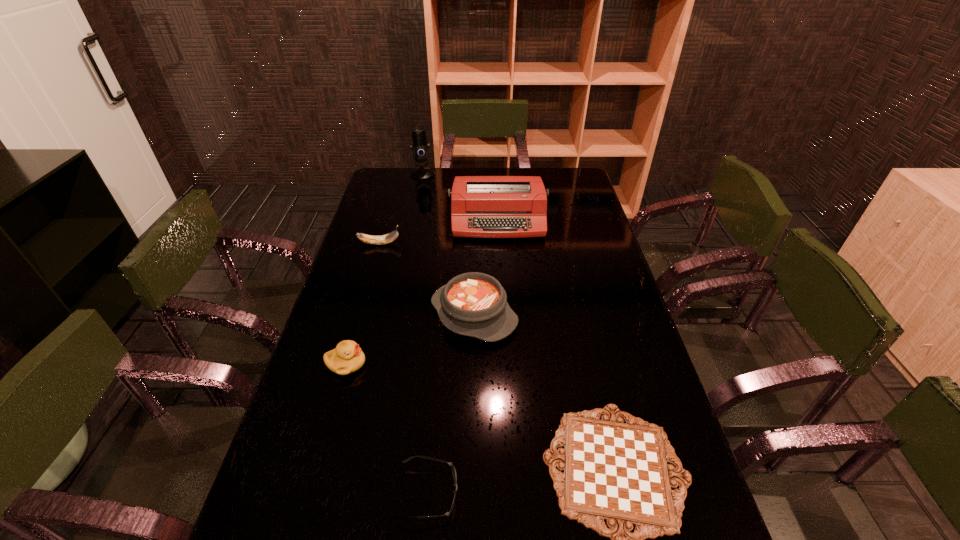
This screenshot has height=540, width=960. Identify the location of vacant space that satisfies the following two spatial constraints: 1. on the typing side of the typewriter; 2. on the lenses of the sunglasses. (514, 493).

Locate an element on the screen. vacant space that satisfies the following two spatial constraints: 1. on the stand of the tallest object; 2. on the right side of the fourth nearest object is located at coordinates (394, 314).

The height and width of the screenshot is (540, 960). In order to click on vacant area that satisfies the following two spatial constraints: 1. on the typing side of the second tallest object; 2. at the stem of the banana in this screenshot , I will do 499,244.

Locate an element on the screen. Image resolution: width=960 pixels, height=540 pixels. vacant space that satisfies the following two spatial constraints: 1. at the stem of the casserole; 2. on the right side of the banana is located at coordinates (359, 314).

I want to click on vacant region that satisfies the following two spatial constraints: 1. at the stem of the banana; 2. on the back side of the fourth nearest object, so pos(359,314).